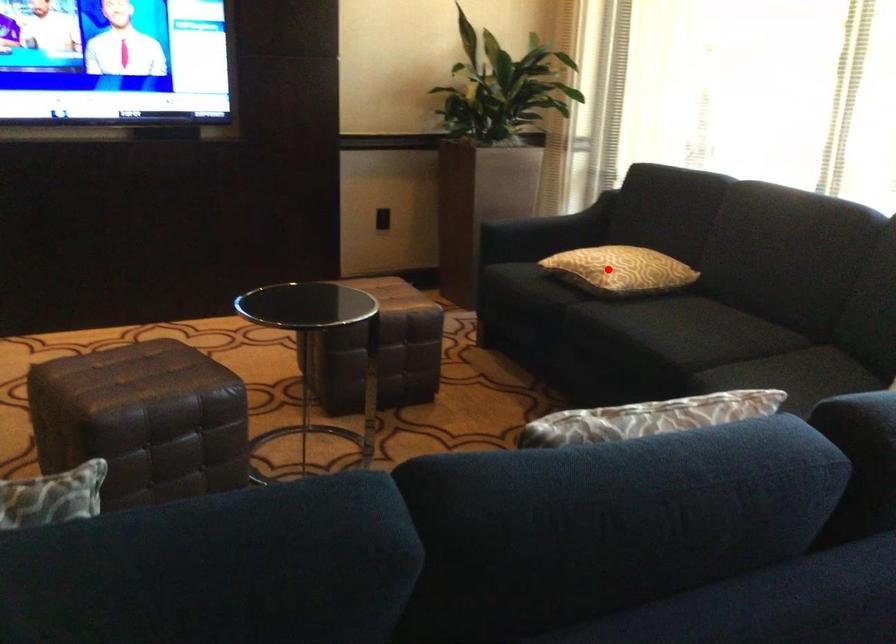
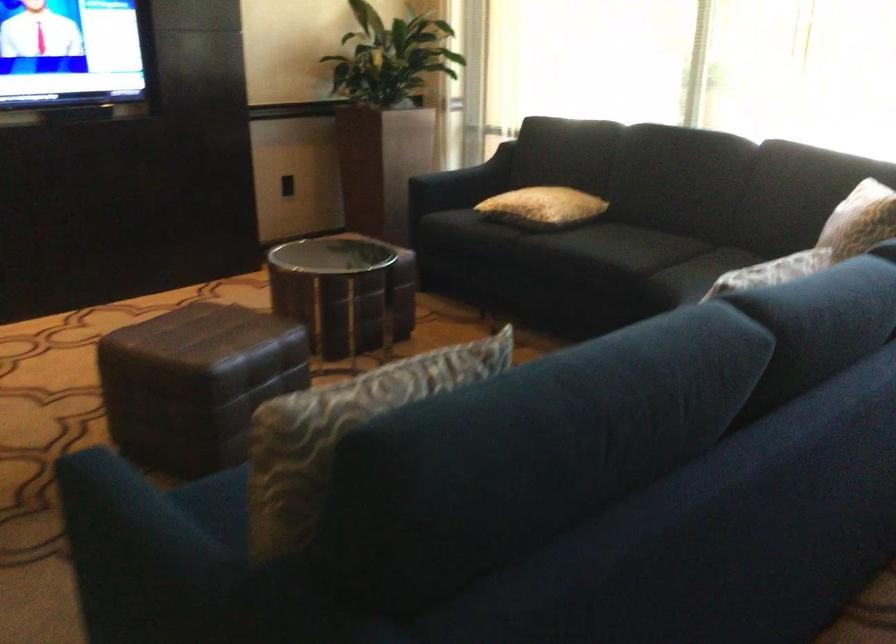
Question: A red point is marked in image1. In image2, is the corresponding 3D point closer to the camera or farther? Reply with the corresponding letter.

Choices:
 (A) The corresponding 3D point is closer.
 (B) The corresponding 3D point is farther.

Answer: (B)